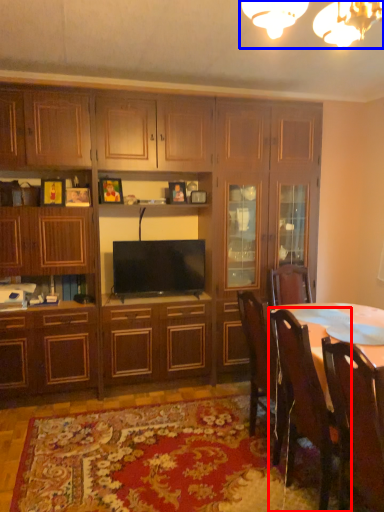
Question: Which of the following is the closest to the observer, chair (highlighted by a red box) or light fixture (highlighted by a blue box)?

Choices:
 (A) chair
 (B) light fixture

Answer: (B)